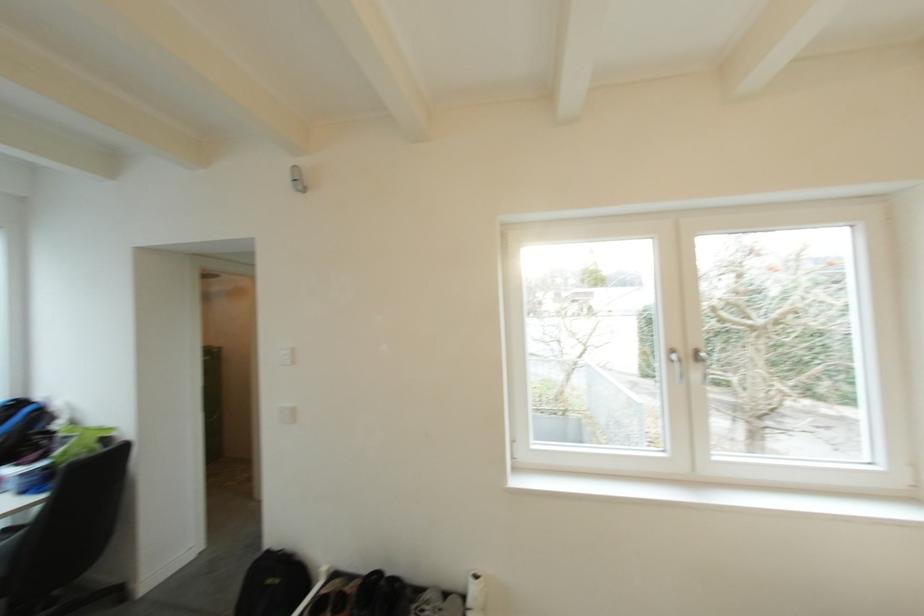
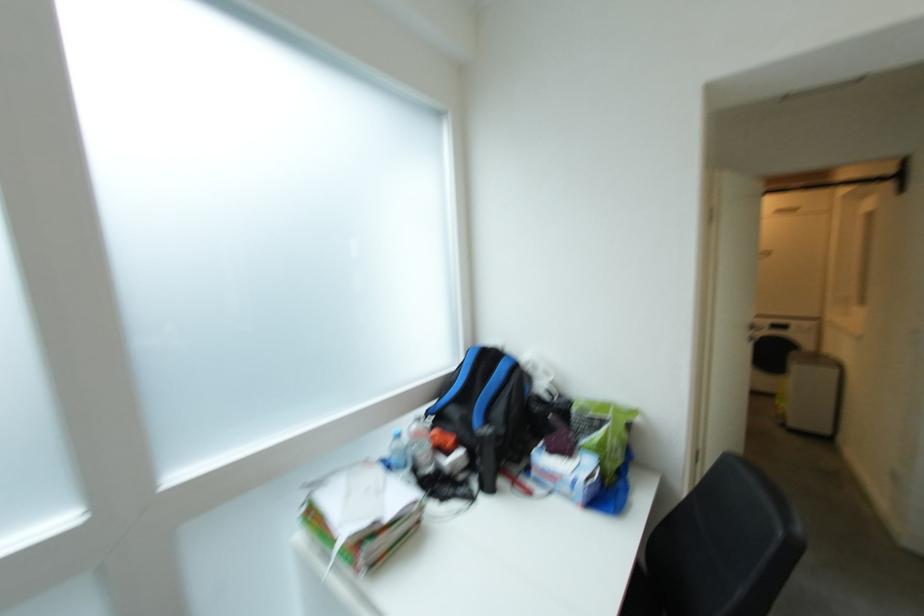
Question: In a continuous first-person perspective shot, in which direction is the camera moving?

Choices:
 (A) Left
 (B) Right
 (C) Forward
 (D) Backward

Answer: (A)